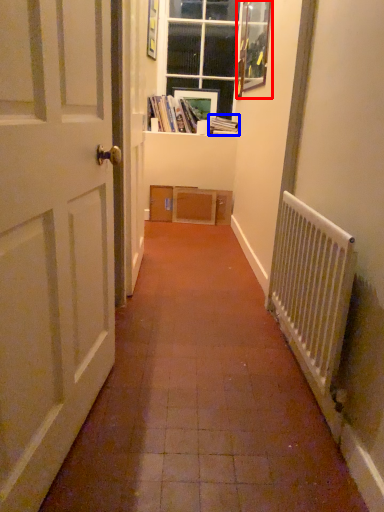
Question: Which of the following is the closest to the observer, picture frame (highlighted by a red box) or book (highlighted by a blue box)?

Choices:
 (A) picture frame
 (B) book

Answer: (A)